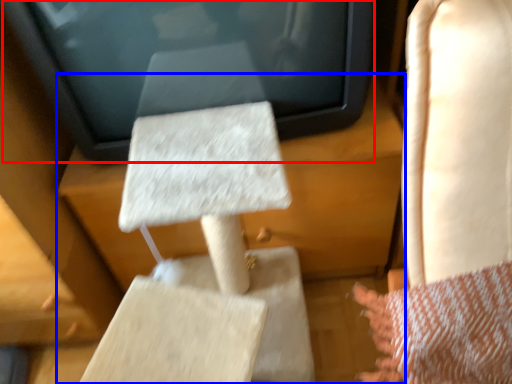
Question: Which of the following is the closest to the observer, electronic (highlighted by a red box) or furniture (highlighted by a blue box)?

Choices:
 (A) electronic
 (B) furniture

Answer: (B)